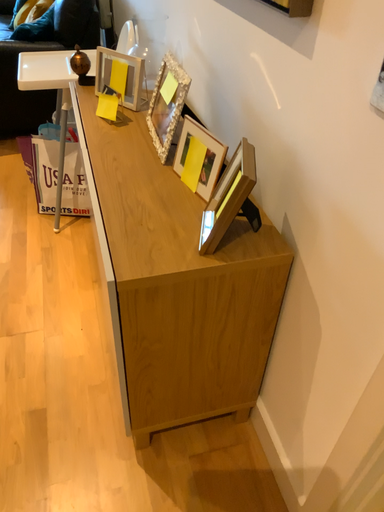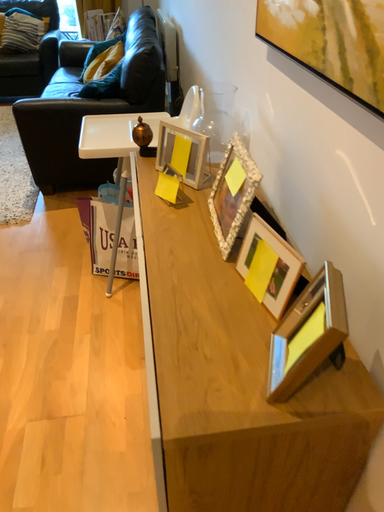
Question: How did the camera likely rotate when shooting the video?

Choices:
 (A) rotated right
 (B) rotated left

Answer: (B)